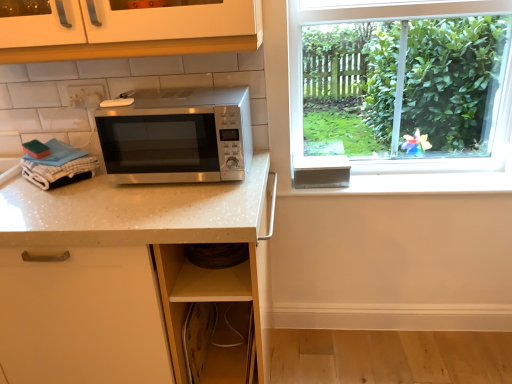
Question: From the image's perspective, does satin silver microwave at center appear lower than white speckled quartz at center?

Choices:
 (A) yes
 (B) no

Answer: (B)

Question: Is satin silver microwave at center behind white speckled quartz at center?

Choices:
 (A) yes
 (B) no

Answer: (A)

Question: Are satin silver microwave at center and white speckled quartz at center beside each other?

Choices:
 (A) yes
 (B) no

Answer: (B)

Question: Is satin silver microwave at center positioned with its back to white speckled quartz at center?

Choices:
 (A) no
 (B) yes

Answer: (A)

Question: Can we say satin silver microwave at center lies outside white speckled quartz at center?

Choices:
 (A) no
 (B) yes

Answer: (B)

Question: Does satin silver microwave at center appear on the right side of white speckled quartz at center?

Choices:
 (A) yes
 (B) no

Answer: (A)

Question: From the image's perspective, is white speckled quartz at center located above satin silver microwave at center?

Choices:
 (A) yes
 (B) no

Answer: (B)

Question: Is white speckled quartz at center oriented away from satin silver microwave at center?

Choices:
 (A) no
 (B) yes

Answer: (A)

Question: Is the surface of white speckled quartz at center in direct contact with satin silver microwave at center?

Choices:
 (A) no
 (B) yes

Answer: (A)

Question: Is white speckled quartz at center completely or partially outside of satin silver microwave at center?

Choices:
 (A) yes
 (B) no

Answer: (A)

Question: Considering the relative sizes of white speckled quartz at center and satin silver microwave at center in the image provided, is white speckled quartz at center wider than satin silver microwave at center?

Choices:
 (A) no
 (B) yes

Answer: (B)

Question: From a real-world perspective, is white speckled quartz at center over satin silver microwave at center?

Choices:
 (A) yes
 (B) no

Answer: (B)

Question: Is white speckled quartz at center facing towards white plastic electric outlet at upper left?

Choices:
 (A) no
 (B) yes

Answer: (A)